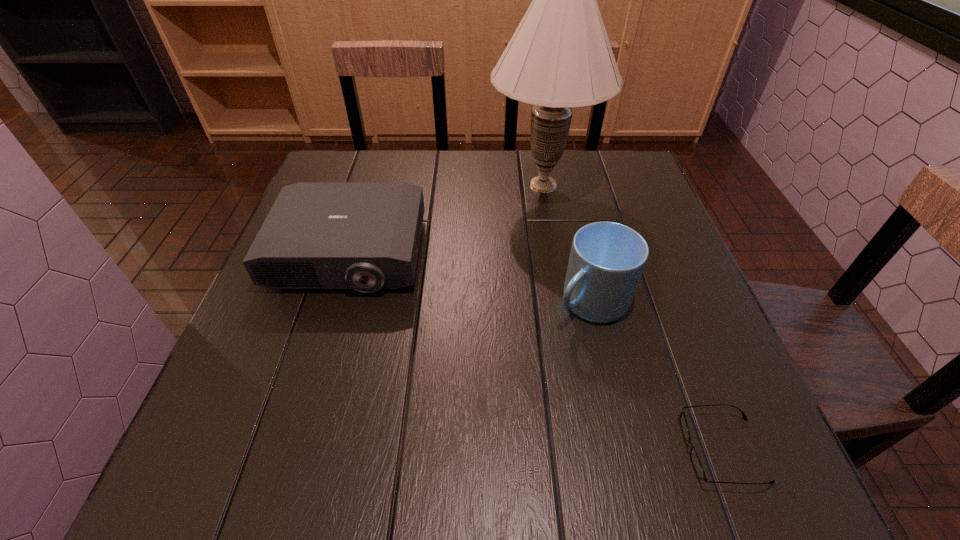
Where is `empty location between the spectacles and the lampshade`? The height and width of the screenshot is (540, 960). empty location between the spectacles and the lampshade is located at coordinates (633, 317).

Where is `vacant area that lies between the tallest object and the third tallest object`? vacant area that lies between the tallest object and the third tallest object is located at coordinates (446, 219).

Locate an element on the screen. The width and height of the screenshot is (960, 540). vacant point located between the lampshade and the leftmost object is located at coordinates (446, 219).

Identify the location of free spot between the shortest object and the second tallest object. (657, 376).

Where is `free space between the lampshade and the mug`? Image resolution: width=960 pixels, height=540 pixels. free space between the lampshade and the mug is located at coordinates (567, 243).

Locate an element on the screen. This screenshot has width=960, height=540. free space between the second tallest object and the shortest object is located at coordinates (657, 376).

At what (x,y) coordinates should I click in order to perform the action: click on free space that is in between the tallest object and the mug. Please return your answer as a coordinate pair (x, y). Image resolution: width=960 pixels, height=540 pixels. Looking at the image, I should click on (567, 243).

Locate an element on the screen. object identified as the third closest to the tallest object is located at coordinates (696, 463).

Where is `object that is the second closest to the lampshade`? The image size is (960, 540). object that is the second closest to the lampshade is located at coordinates (607, 259).

Locate an element on the screen. This screenshot has width=960, height=540. free spot that satisfies the following two spatial constraints: 1. on the front-facing side of the leftmost object; 2. on the right side of the third shortest object is located at coordinates (335, 302).